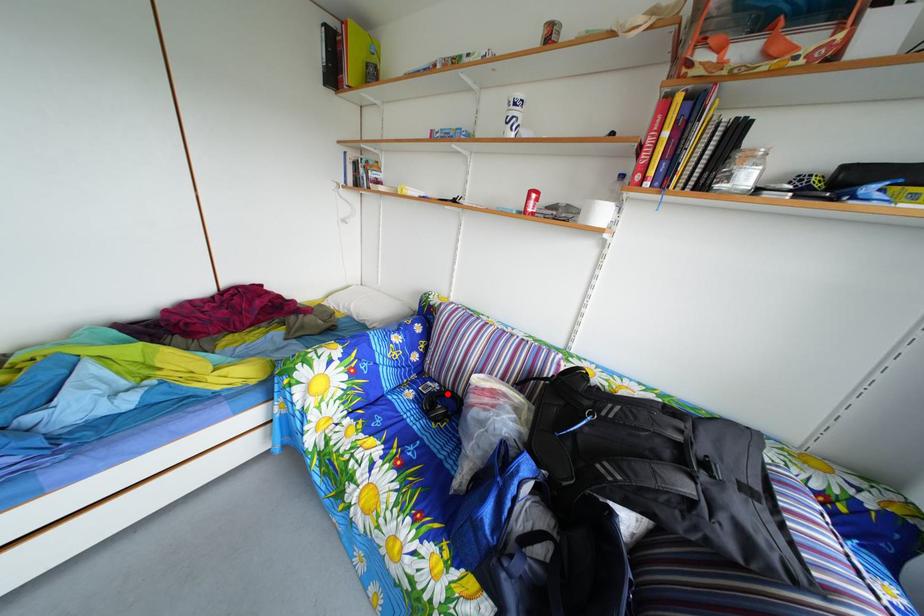
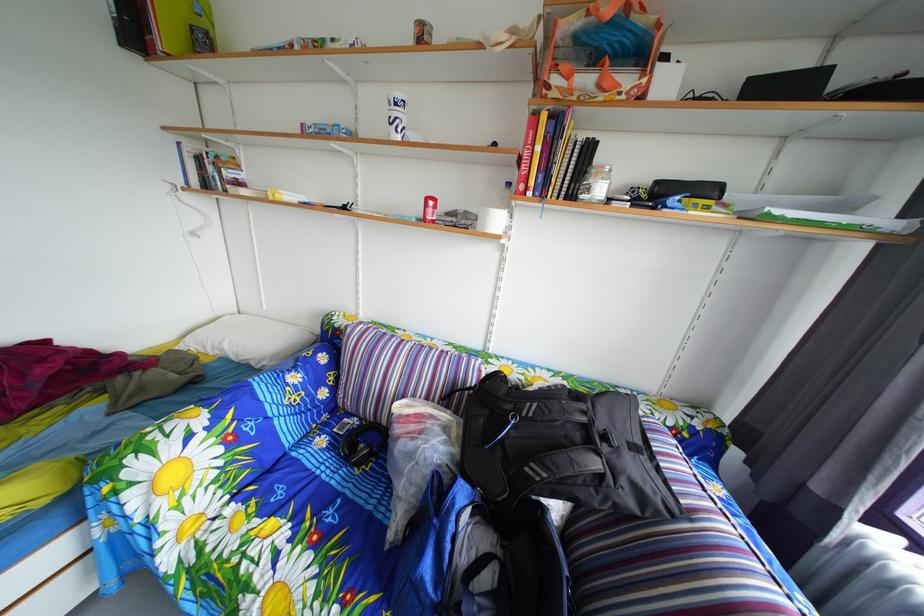
Question: I am providing you with two images of the same scene from different viewpoints. In image1, a red point is highlighted. Considering the same 3D point in image2, which of the following is correct?

Choices:
 (A) It is closer
 (B) It is farther

Answer: (B)